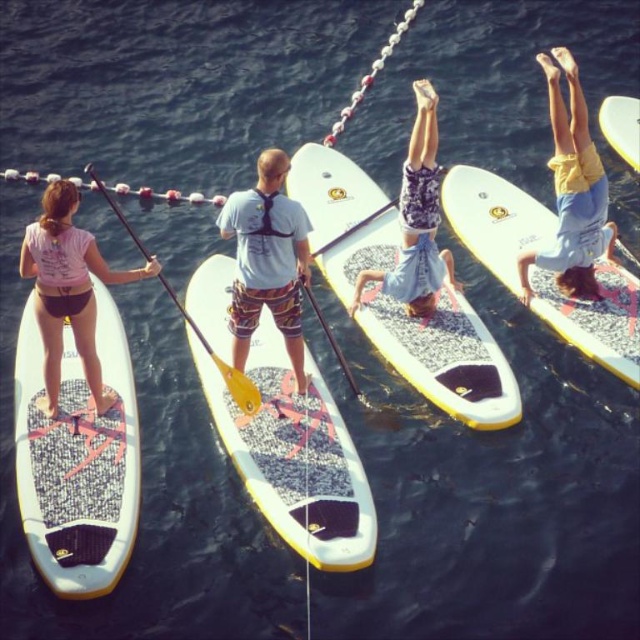
Question: Does speckled rubber paddleboard at center appear under white speckled surfboard at upper right?

Choices:
 (A) yes
 (B) no

Answer: (A)

Question: Which point is farther to the camera?

Choices:
 (A) white matte surfboard at upper right
 (B) yellow matte paddle at upper center
 (C) white textured surfboard at center
 (D) patterned fabric shorts at center

Answer: (A)

Question: Does yellow fabric shorts at upper right appear under patterned fabric shorts at center?

Choices:
 (A) no
 (B) yes

Answer: (A)

Question: Which object is positioned closest to the matte gray paddleboard at center?

Choices:
 (A) white speckled surfboard at upper right
 (B) speckled rubber paddleboard at center

Answer: (B)

Question: Where is speckled rubber paddleboard at center located in relation to white textured surfboard at center in the image?

Choices:
 (A) right
 (B) left

Answer: (B)

Question: Among these points, which one is nearest to the camera?

Choices:
 (A) (566, 228)
 (B) (596, 317)
 (C) (602, 106)
 (D) (208, 284)

Answer: (B)